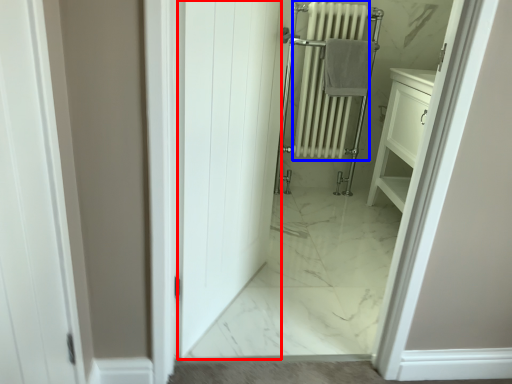
Question: Which object appears closest to the camera in this image, door (highlighted by a red box) or radiator (highlighted by a blue box)?

Choices:
 (A) door
 (B) radiator

Answer: (A)